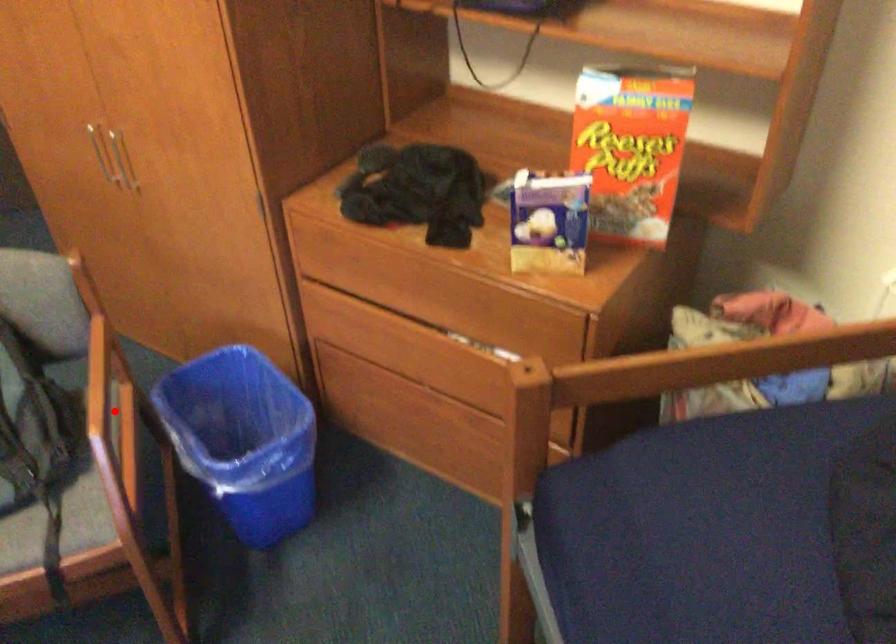
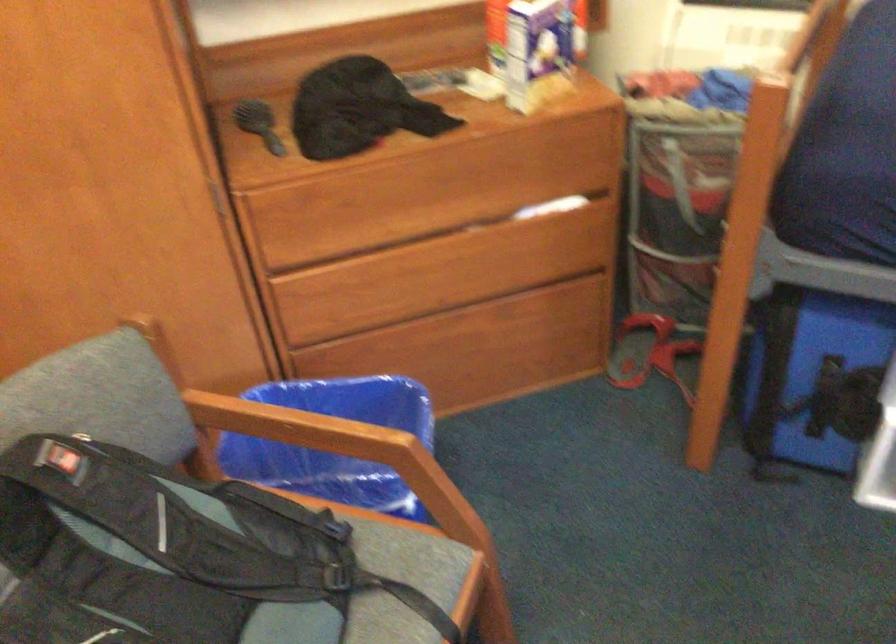
Question: I am providing you with two images of the same scene from different viewpoints. A red point is shown in image1. For the corresponding object point in image2, is it positioned nearer or farther from the camera?

Choices:
 (A) Nearer
 (B) Farther

Answer: (A)